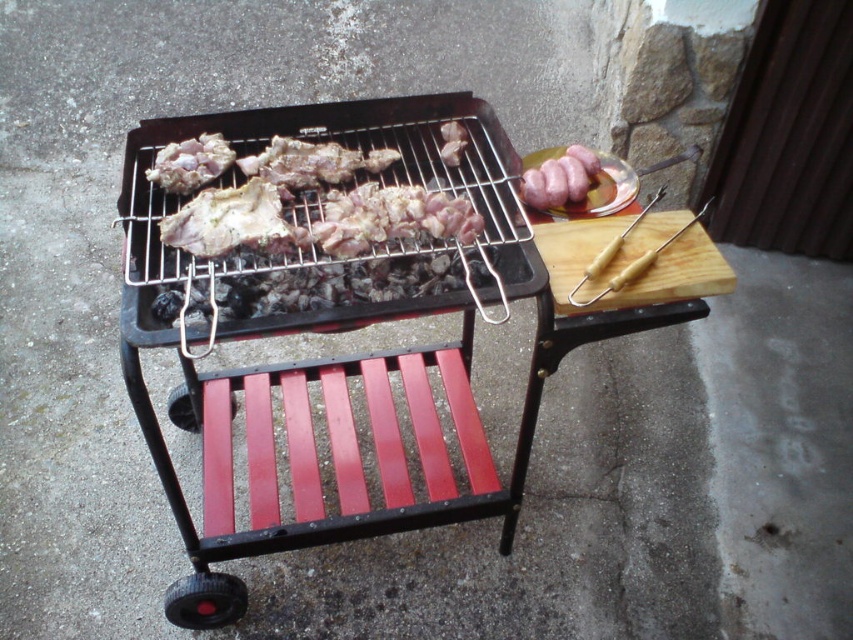
Question: Which point is farther to the camera?

Choices:
 (A) (421, 429)
 (B) (289, 234)
 (C) (183, 168)

Answer: (A)

Question: Can you confirm if grilled meat at center is positioned to the left of pinkish matte meat at center?

Choices:
 (A) no
 (B) yes

Answer: (B)

Question: Which point is closer to the camera?

Choices:
 (A) (183, 173)
 (B) (343, 257)
 (C) (456, 157)

Answer: (B)

Question: Is grilled meat at center wider than pinkish matte meat at center?

Choices:
 (A) no
 (B) yes

Answer: (B)

Question: Among these objects, which one is nearest to the camera?

Choices:
 (A) pinkish matte meat at center
 (B) grilled meat at center

Answer: (B)

Question: Can you confirm if brown meaty bone at center is bigger than white meat at center?

Choices:
 (A) no
 (B) yes

Answer: (B)